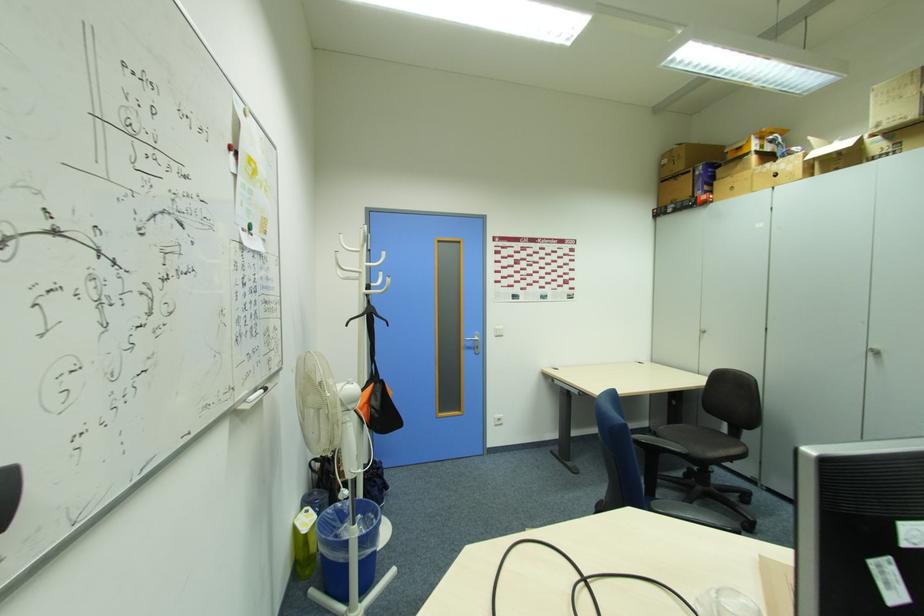
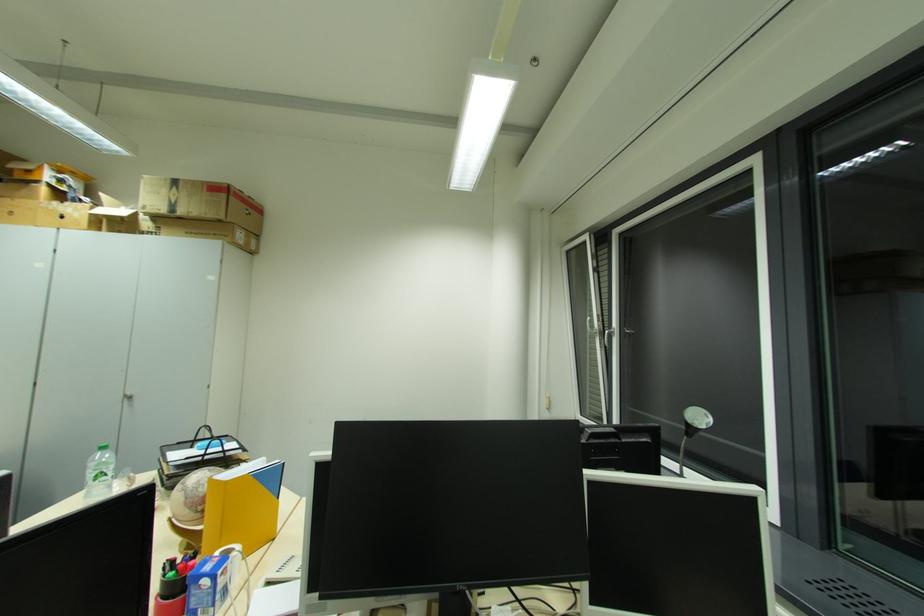
The point at (889, 123) is marked in the first image. Where is the corresponding point in the second image?

(152, 209)